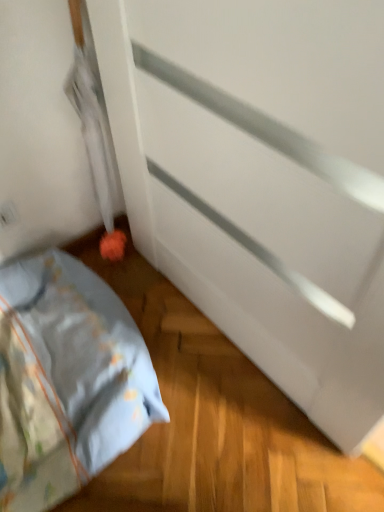
This screenshot has width=384, height=512. Describe the element at coordinates (66, 380) in the screenshot. I see `light blue fabric bed at lower left` at that location.

Locate an element on the screen. The height and width of the screenshot is (512, 384). light blue fabric bed at lower left is located at coordinates (66, 380).

Image resolution: width=384 pixels, height=512 pixels. In order to click on light blue fabric bed at lower left in this screenshot , I will do `click(66, 380)`.